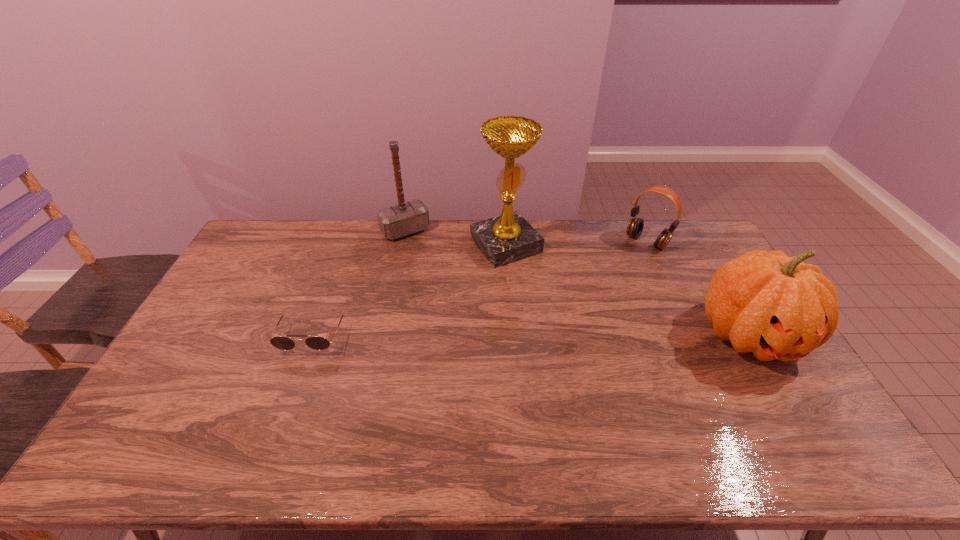
Identify the location of hammer located at the far edge. (406, 218).

Find the location of a particular element. The width and height of the screenshot is (960, 540). object present at the right edge is located at coordinates (777, 307).

This screenshot has height=540, width=960. In the image, there is a desktop. Find the location of `vacant region at the far edge`. vacant region at the far edge is located at coordinates (410, 234).

In the image, there is a desktop. Identify the location of free space at the near edge. The image size is (960, 540). (374, 406).

The width and height of the screenshot is (960, 540). In order to click on free region at the right edge in this screenshot , I will do `click(690, 264)`.

Identify the location of vacant space at the far left corner of the desktop. The height and width of the screenshot is (540, 960). (279, 254).

Where is `vacant area at the far right corner`? vacant area at the far right corner is located at coordinates (661, 228).

In order to click on free space between the leftmost object and the pumpkin in this screenshot , I will do `click(532, 335)`.

You are a GUI agent. You are given a task and a screenshot of the screen. Output one action in this format:
    pyautogui.click(x=<x>, y=<y>)
    Task: Click on the vacant area between the shortest object and the fourth tallest object
    
    Given the screenshot: What is the action you would take?
    pyautogui.click(x=480, y=288)

Locate an element on the screen. The image size is (960, 540). free spot between the shortest object and the fourth tallest object is located at coordinates (480, 288).